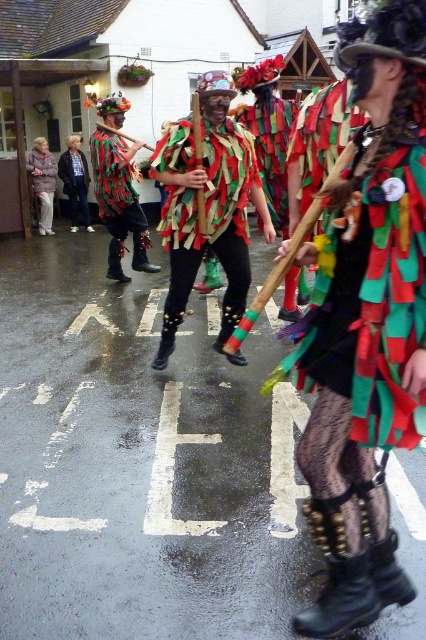
Does shiny metallic costume at center lie behind matte black pants at left?

No, shiny metallic costume at center is in front of matte black pants at left.

Is shiny metallic costume at center bigger than matte black pants at left?

Correct, shiny metallic costume at center is larger in size than matte black pants at left.

Between point (120, 152) and point (28, 157), which one is positioned behind?

The point (28, 157) is behind.

Identify the location of shiny metallic costume at center. The image size is (426, 640). (118, 189).

Is multicolored fabric strips at center taller than shiny metallic costume at center?

No.

From the picture: Which is more to the left, multicolored fabric strips at center or shiny metallic costume at center?

Positioned to the left is shiny metallic costume at center.

Does point (155, 157) come closer to viewer compared to point (132, 257)?

Yes, point (155, 157) is closer to viewer.

Locate an element on the screen. The image size is (426, 640). multicolored fabric strips at center is located at coordinates (212, 221).

Is textured fabric costume at center wider than multicolored fabric strips at center?

Incorrect, textured fabric costume at center's width does not surpass multicolored fabric strips at center's.

How much distance is there between textured fabric costume at center and multicolored fabric strips at center?

textured fabric costume at center is 7.00 feet from multicolored fabric strips at center.

The height and width of the screenshot is (640, 426). What are the coordinates of `textured fabric costume at center` in the screenshot? It's located at (365, 323).

What are the coordinates of `textured fabric costume at center` in the screenshot? It's located at (365, 323).